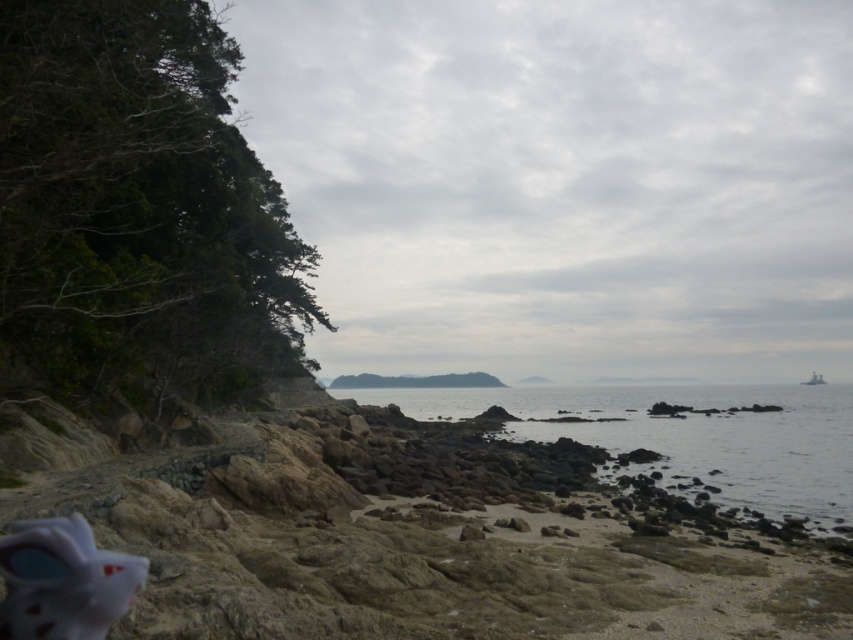
You are standing on the rocky beach at lower left and want to reach the clear water at center. Which direction should you move to get there?

Since the rocky beach at lower left is located above the clear water at center, you should move downward towards the clear water at center to reach it.

You are standing on the rocky beach at lower left and want to reach the clear water at center. Which direction should you move in to get there?

You should move to the right, since the rocky beach at lower left is to the left of the clear water at center.

You are standing at the edge of the rocky beach at lower left and want to throw a pebble to reach the dense cluster of greenery on the left side. The distance between you and the greenery is 6 meters. Can you successfully throw the pebble to reach the greenery?

The distance between the rocky beach at lower left and the viewer is 5.90 meters. Since you are standing at the edge of the rocky beach at lower left, the total distance to the greenery would be your distance from the edge plus the 5.90 meters. However, the problem states the distance between you and the greenery is 6 meters, which is slightly longer than 5.90 meters. Therefore, it might be challenging to throw the pebble that far, but it is possible if you can throw at least 6 meters.